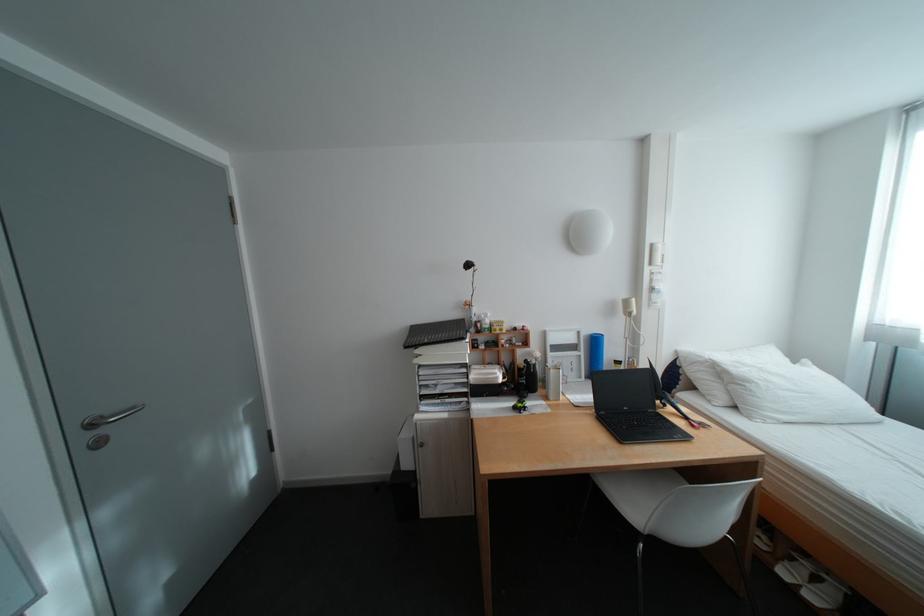
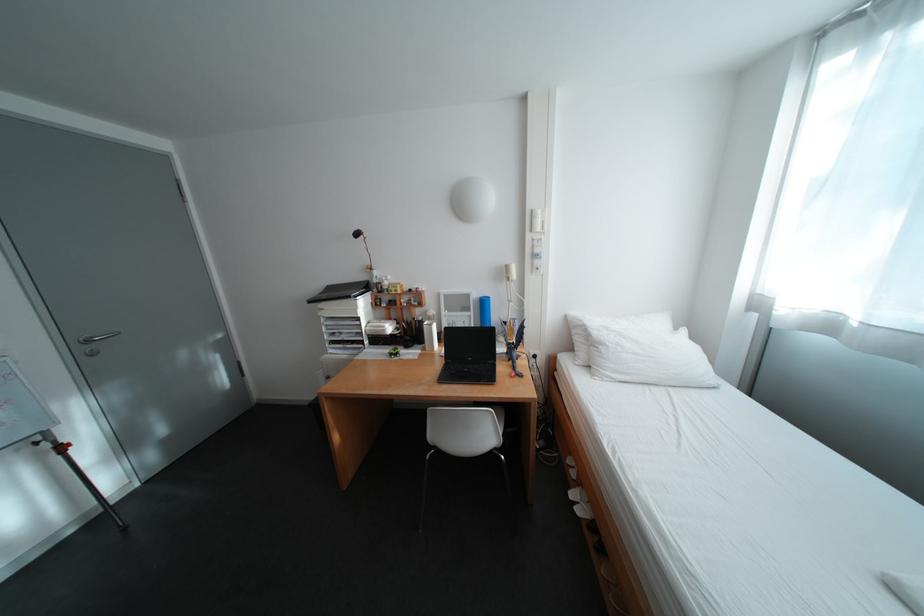
The point at (761, 384) is marked in the first image. Where is the corresponding point in the second image?

(614, 346)